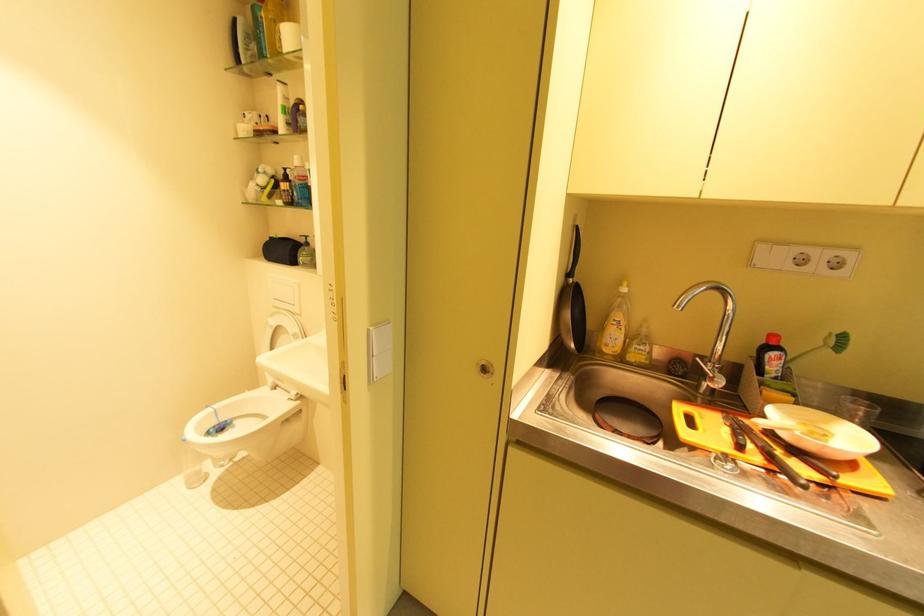
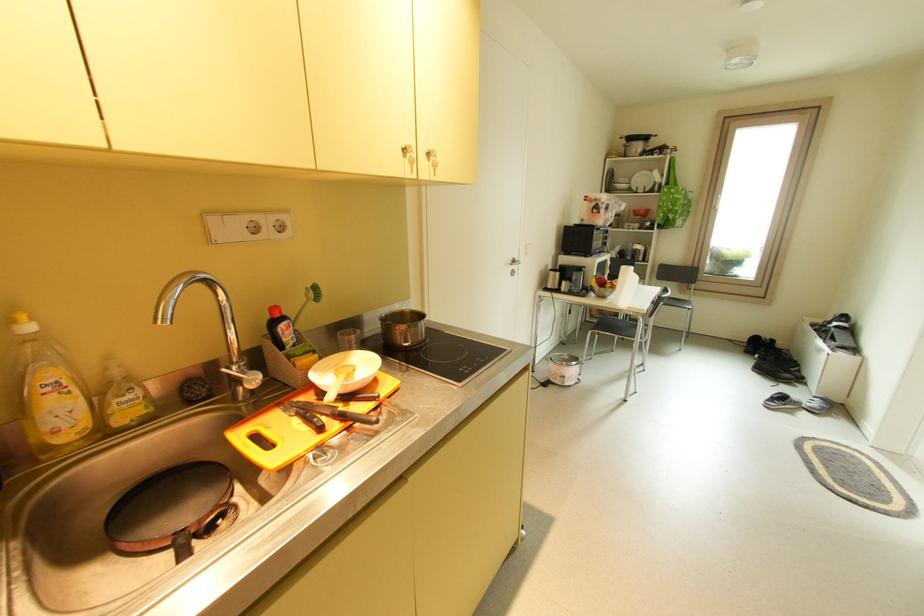
Where in the second image is the point corresponding to point (769, 342) from the first image?

(274, 318)